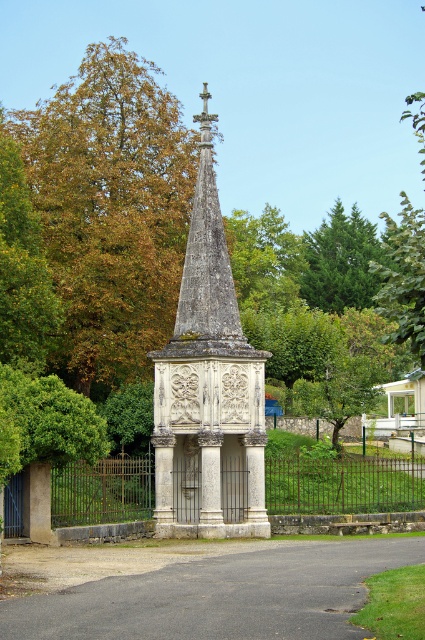
From the picture: Is white stone monument at center wider than brown metal fence at center?

No, white stone monument at center is not wider than brown metal fence at center.

Does point (220, 221) come in front of point (354, 508)?

Yes, it is in front of point (354, 508).

Looking at this image, who is more distant from viewer, [203,115] or [266,468]?

The point [266,468] is more distant.

Image resolution: width=425 pixels, height=640 pixels. I want to click on white stone monument at center, so click(207, 380).

Which is below, white stone monument at center or green coniferous tree at upper right?

Positioned lower is white stone monument at center.

The image size is (425, 640). Find the location of `white stone monument at center`. white stone monument at center is located at coordinates (207, 380).

Does brown metal fence at center have a lesser height compared to green coniferous tree at upper right?

Yes, brown metal fence at center is shorter than green coniferous tree at upper right.

Which is below, brown metal fence at center or green coniferous tree at upper right?

Positioned lower is brown metal fence at center.

Does point (70, 493) lie behind point (334, 305)?

That is False.

Find the location of a particular element. Image resolution: width=425 pixels, height=640 pixels. brown metal fence at center is located at coordinates (342, 488).